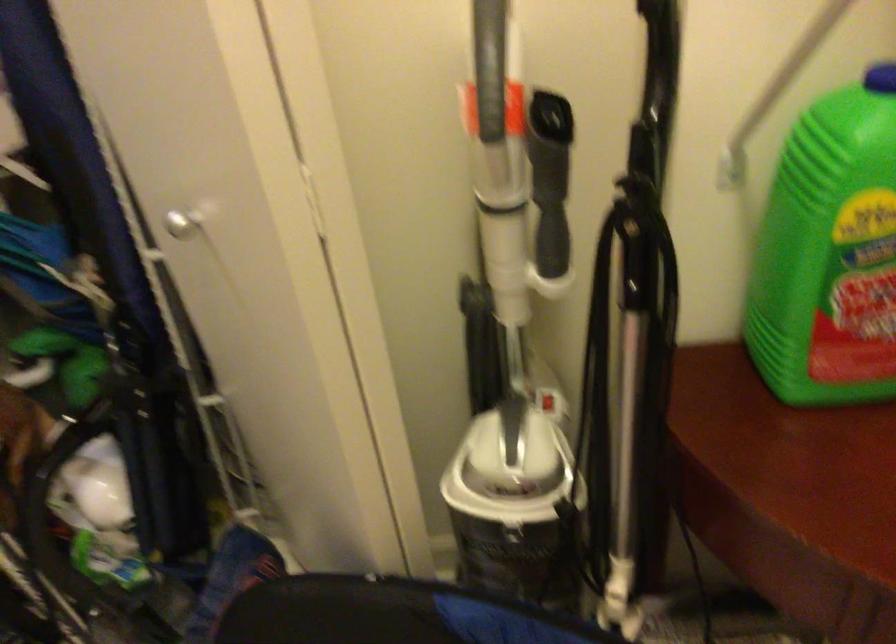
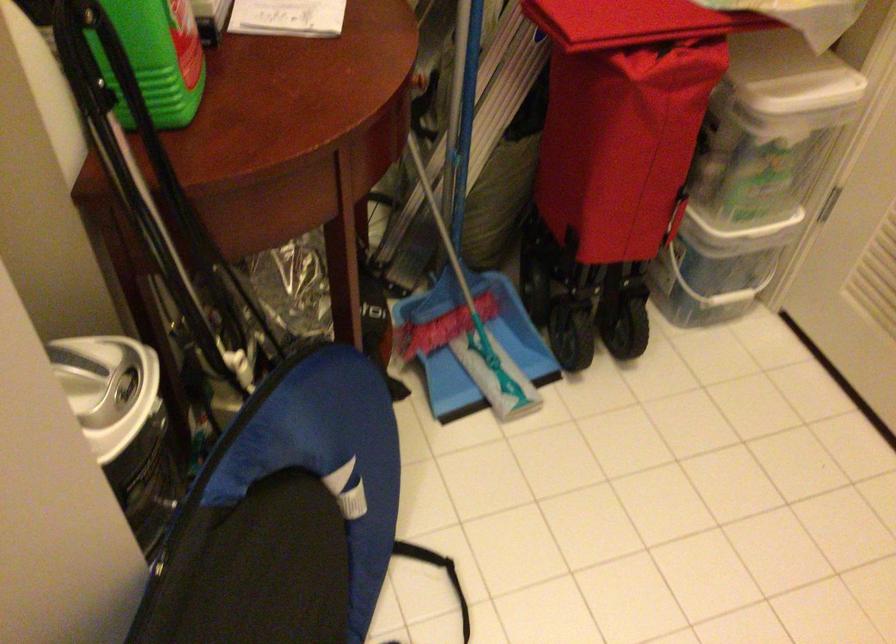
The point at [784,325] is marked in the first image. Where is the corresponding point in the second image?

(156, 59)